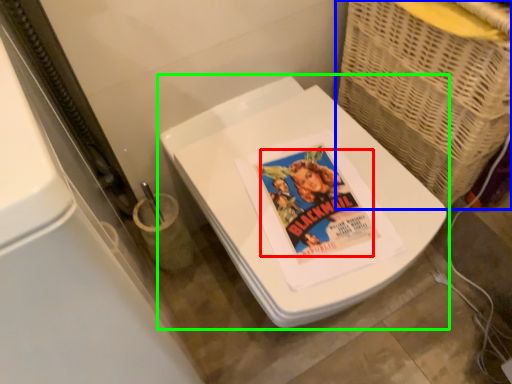
Question: Which object is the farthest from comic book character (highlighted by a red box)? Choose among these: basket (highlighted by a blue box) or toilet (highlighted by a green box).

Choices:
 (A) basket
 (B) toilet

Answer: (A)